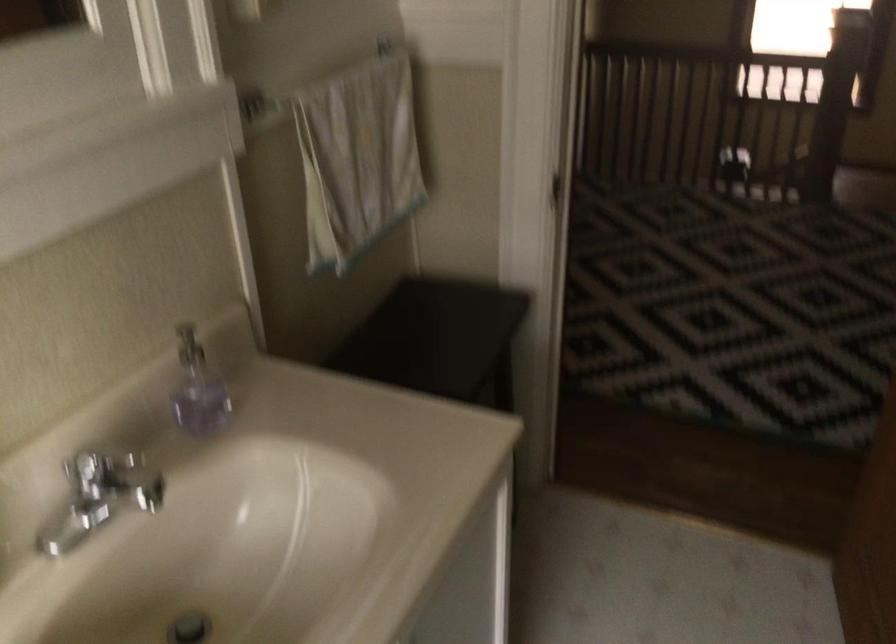
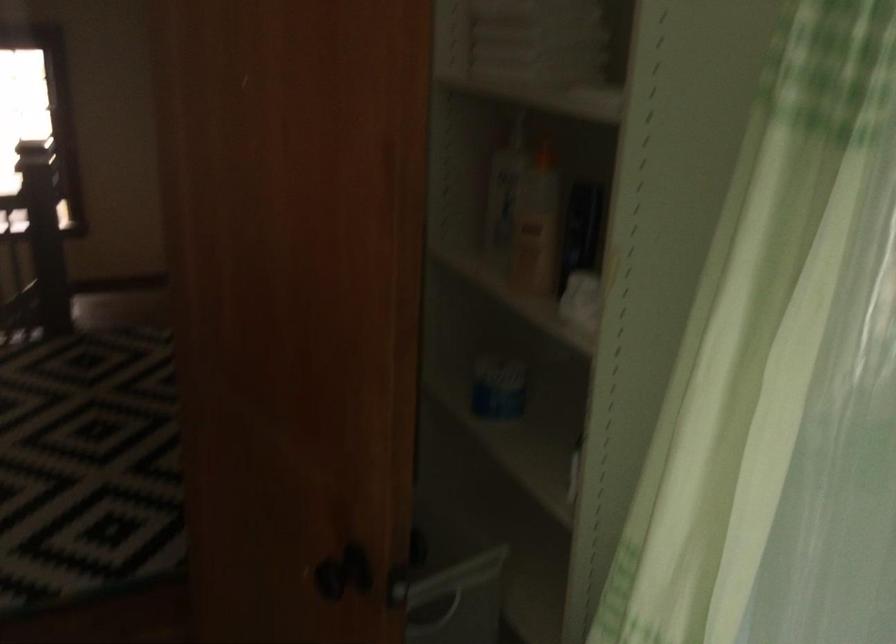
Question: Based on the continuous images, in which direction is the camera rotating? Reply with the corresponding letter.

Choices:
 (A) Left
 (B) Right
 (C) Up
 (D) Down

Answer: (B)